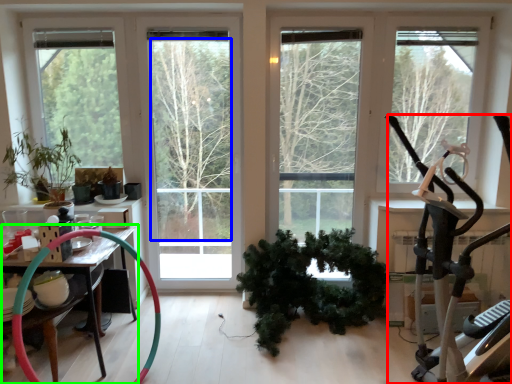
Question: Estimate the real-world distances between objects in this image. Which object is farther from stationary bicycle (highlighted by a red box), tree (highlighted by a blue box) or table (highlighted by a green box)?

Choices:
 (A) tree
 (B) table

Answer: (A)